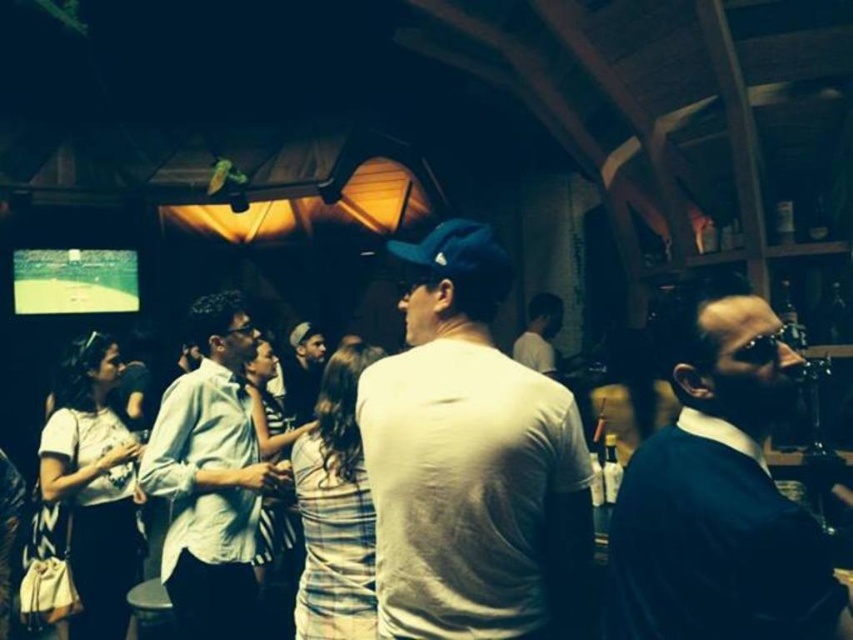
What is located at the coordinate point (x=302, y=371) in the image?

The dark gray knit cap at center is located at the coordinate point (x=302, y=371).

You are a photographer setting up for an event. You need to position a spotlight that can reach both the dark blue sweater at right and the light blue striped shirt at center. Considering their heights, which object requires the spotlight to be adjusted higher?

A: The light blue striped shirt at center requires the spotlight to be adjusted higher because it is taller than the dark blue sweater at right.

You are a photographer trying to capture a candid shot of the two people at the center of the scene. The dark gray knit cap at center and the white matte shirt at center are your subjects. Based on their positions, which subject is closer to the camera?

The dark gray knit cap at center is below the white matte shirt at center, so the white matte shirt at center is closer to the camera.